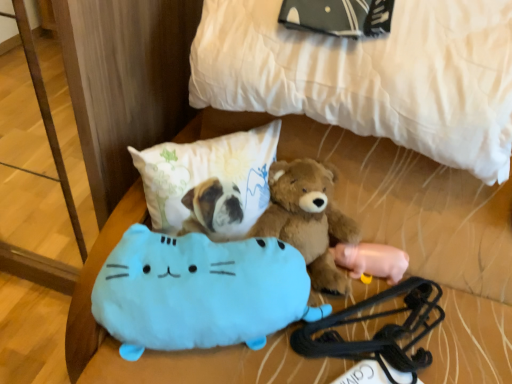
Where is `pink rubber pig at lower right, acting as the 2th toy starting from the front`? Image resolution: width=512 pixels, height=384 pixels. pink rubber pig at lower right, acting as the 2th toy starting from the front is located at coordinates (371, 260).

Locate an element on the screen. This screenshot has width=512, height=384. fluffy white pillow at center is located at coordinates (209, 182).

This screenshot has width=512, height=384. Identify the location of light blue plush cat at lower center, the 1th toy from the left. (199, 292).

Where is `brown plush teddy bear at center`? brown plush teddy bear at center is located at coordinates (307, 219).

At what (x,y) coordinates should I click in order to perform the action: click on black rubber luggage strap at lower right. Please return your answer as a coordinate pair (x, y). Looking at the image, I should click on (378, 331).

Considering the positions of objects pink rubber pig at lower right, the 2th toy viewed from the left, and light blue plush cat at lower center, marked as the second toy in a back-to-front arrangement, in the image provided, who is in front, pink rubber pig at lower right, the 2th toy viewed from the left, or light blue plush cat at lower center, marked as the second toy in a back-to-front arrangement,?

light blue plush cat at lower center, marked as the second toy in a back-to-front arrangement, is closer to the camera.

From the image's perspective, which is above, pink rubber pig at lower right, the 2th toy viewed from the left, or light blue plush cat at lower center, the 1th toy from the left?

pink rubber pig at lower right, the 2th toy viewed from the left, is shown above in the image.

I want to click on toy that appears in front of the pink rubber pig at lower right, placed as the first toy when sorted from back to front, so click(199, 292).

In terms of width, does pink rubber pig at lower right, the 2th toy viewed from the left, look wider or thinner when compared to light blue plush cat at lower center, marked as the second toy in a back-to-front arrangement?

Clearly, pink rubber pig at lower right, the 2th toy viewed from the left, has less width compared to light blue plush cat at lower center, marked as the second toy in a back-to-front arrangement.

Is white quilted bed at upper center completely or partially inside black rubber luggage strap at lower right?

No, white quilted bed at upper center is not inside black rubber luggage strap at lower right.

Looking at their sizes, would you say black rubber luggage strap at lower right is wider or thinner than white quilted bed at upper center?

Considering their sizes, black rubber luggage strap at lower right looks slimmer than white quilted bed at upper center.

How many degrees apart are the facing directions of black rubber luggage strap at lower right and white quilted bed at upper center?

43.1 degrees.

Is black rubber luggage strap at lower right facing away from white quilted bed at upper center?

No, white quilted bed at upper center is not at the back of black rubber luggage strap at lower right.

Considering the sizes of objects black rubber luggage strap at lower right and pink rubber pig at lower right, acting as the 2th toy starting from the front, in the image provided, who is thinner, black rubber luggage strap at lower right or pink rubber pig at lower right, acting as the 2th toy starting from the front,?

Thinner between the two is pink rubber pig at lower right, acting as the 2th toy starting from the front.

Are black rubber luggage strap at lower right and pink rubber pig at lower right, placed as the first toy when sorted from back to front, located far from each other?

black rubber luggage strap at lower right is actually quite close to pink rubber pig at lower right, placed as the first toy when sorted from back to front.

Can you confirm if black rubber luggage strap at lower right is positioned to the left of pink rubber pig at lower right, the 2th toy viewed from the left?

Yes, black rubber luggage strap at lower right is to the left of pink rubber pig at lower right, the 2th toy viewed from the left.

What's the angular difference between black rubber luggage strap at lower right and pink rubber pig at lower right, acting as the 2th toy starting from the front,'s facing directions?

There is a 43.3-degree angle between the facing directions of black rubber luggage strap at lower right and pink rubber pig at lower right, acting as the 2th toy starting from the front.

Does fluffy white pillow at center have a greater height compared to light blue plush cat at lower center, marked as the second toy in a back-to-front arrangement?

Yes.

Could you measure the distance between fluffy white pillow at center and light blue plush cat at lower center, the 1th toy from the left?

They are 6.01 inches apart.

Considering the relative sizes of fluffy white pillow at center and light blue plush cat at lower center, which is counted as the second toy, starting from the right, in the image provided, is fluffy white pillow at center wider than light blue plush cat at lower center, which is counted as the second toy, starting from the right,?

No, fluffy white pillow at center is not wider than light blue plush cat at lower center, which is counted as the second toy, starting from the right.

Is point (263, 208) positioned before point (298, 301)?

No, it is not.

Is white quilted bed at upper center positioned far away from black rubber luggage strap at lower right?

white quilted bed at upper center is near black rubber luggage strap at lower right, not far away.

I want to click on bed above the black rubber luggage strap at lower right (from a real-world perspective), so click(371, 76).

Would you say white quilted bed at upper center is to the left or to the right of black rubber luggage strap at lower right in the picture?

In the image, white quilted bed at upper center appears on the left side of black rubber luggage strap at lower right.

Looking at their sizes, would you say white quilted bed at upper center is wider or thinner than black rubber luggage strap at lower right?

white quilted bed at upper center is wider than black rubber luggage strap at lower right.

Between white quilted bed at upper center and light blue plush cat at lower center, marked as the first toy in a front-to-back arrangement, which one appears on the left side from the viewer's perspective?

light blue plush cat at lower center, marked as the first toy in a front-to-back arrangement.

Considering the positions of points (401, 74) and (128, 290), is point (401, 74) closer to camera compared to point (128, 290)?

That is False.

From a real-world perspective, is white quilted bed at upper center physically located above or below light blue plush cat at lower center, marked as the first toy in a front-to-back arrangement?

Clearly, from a real-world perspective, white quilted bed at upper center is above light blue plush cat at lower center, marked as the first toy in a front-to-back arrangement.

In the image, is white quilted bed at upper center positioned in front of or behind light blue plush cat at lower center, marked as the first toy in a front-to-back arrangement?

Visually, white quilted bed at upper center is located in front of light blue plush cat at lower center, marked as the first toy in a front-to-back arrangement.

From the image's perspective, which is above, white quilted bed at upper center or fluffy white pillow at center?

white quilted bed at upper center, from the image's perspective.

Is white quilted bed at upper center spatially inside fluffy white pillow at center, or outside of it?

The correct answer is: outside.

Would you consider white quilted bed at upper center to be distant from fluffy white pillow at center?

They are positioned close to each other.

There is a pink rubber pig at lower right, the 2th toy viewed from the left. Identify the location of toy above it (from a real-world perspective). This screenshot has width=512, height=384. (199, 292).

Find the location of `equipment that is under the white quilted bed at upper center (from a real-world perspective)`. equipment that is under the white quilted bed at upper center (from a real-world perspective) is located at coordinates (378, 331).

Looking at this image, estimate the real-world distances between objects in this image. Which object is closer to black rubber luggage strap at lower right, light blue plush cat at lower center, marked as the second toy in a back-to-front arrangement, or fluffy white pillow at center?

Based on the image, light blue plush cat at lower center, marked as the second toy in a back-to-front arrangement, appears to be nearer to black rubber luggage strap at lower right.

When comparing their distances from fluffy white pillow at center, does light blue plush cat at lower center, which is counted as the second toy, starting from the right, or white quilted bed at upper center seem closer?

light blue plush cat at lower center, which is counted as the second toy, starting from the right, is closer to fluffy white pillow at center.

Considering their positions, is brown plush teddy bear at center positioned closer to white quilted bed at upper center than pink rubber pig at lower right, placed as the first toy when sorted from back to front?

Based on the image, brown plush teddy bear at center appears to be nearer to white quilted bed at upper center.

When comparing their distances from brown plush teddy bear at center, does pink rubber pig at lower right, acting as the 1th toy starting from the right, or white quilted bed at upper center seem closer?

Among the two, pink rubber pig at lower right, acting as the 1th toy starting from the right, is located nearer to brown plush teddy bear at center.

Which object lies further to the anchor point pink rubber pig at lower right, the 2th toy viewed from the left, light blue plush cat at lower center, marked as the second toy in a back-to-front arrangement, or brown plush teddy bear at center?

light blue plush cat at lower center, marked as the second toy in a back-to-front arrangement, is further to pink rubber pig at lower right, the 2th toy viewed from the left.

When comparing their distances from fluffy white pillow at center, does brown plush teddy bear at center or light blue plush cat at lower center, the 1th toy from the left, seem further?

Among the two, light blue plush cat at lower center, the 1th toy from the left, is located further to fluffy white pillow at center.

From the image, which object appears to be farther from fluffy white pillow at center, pink rubber pig at lower right, placed as the first toy when sorted from back to front, or black rubber luggage strap at lower right?

Among the two, black rubber luggage strap at lower right is located further to fluffy white pillow at center.

Looking at the image, which one is located closer to white quilted bed at upper center, brown plush teddy bear at center or light blue plush cat at lower center, the 1th toy from the left?

brown plush teddy bear at center is closer to white quilted bed at upper center.

The height and width of the screenshot is (384, 512). I want to click on toy between fluffy white pillow at center and brown plush teddy bear at center, so click(199, 292).

Where is `teddy bear situated between light blue plush cat at lower center, marked as the first toy in a front-to-back arrangement, and black rubber luggage strap at lower right from left to right`? This screenshot has height=384, width=512. teddy bear situated between light blue plush cat at lower center, marked as the first toy in a front-to-back arrangement, and black rubber luggage strap at lower right from left to right is located at coordinates pos(307,219).

Identify the location of teddy bear located between fluffy white pillow at center and black rubber luggage strap at lower right in the left-right direction. (307, 219).

This screenshot has width=512, height=384. I want to click on teddy bear between black rubber luggage strap at lower right and pink rubber pig at lower right, the 2th toy viewed from the left, in the front-back direction, so click(307, 219).